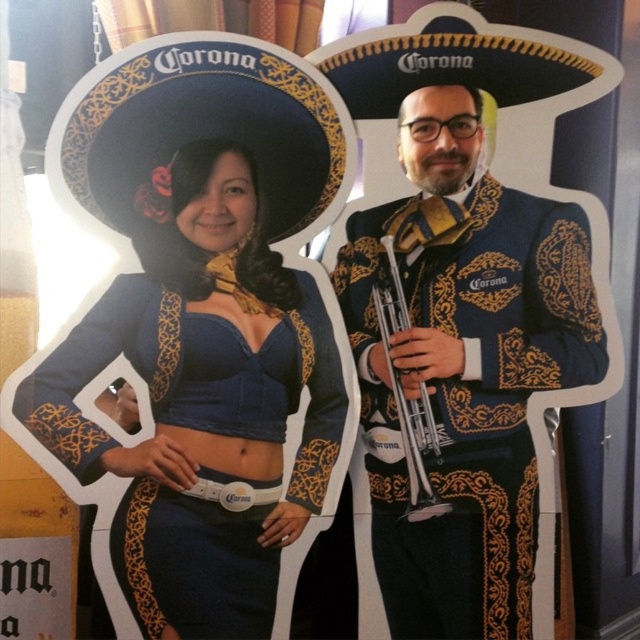
From the picture: You are a stagehand setting up for a performance. You have a matte gold trumpet at center and a matte black sombrero at upper left. The stage manager asks if the trumpet can be placed on top of the sombrero without falling over. Based on their sizes, what do you think?

The matte gold trumpet at center is larger in size than the matte black sombrero at upper left, so placing the trumpet on top of the sombrero might cause it to be unstable and possibly fall over due to the size difference.

You are at a costume party and want to place your silver metallic trumpet at center near the matte blue fabric dress at center. The venue requires that decorations be at least 10 inches apart for safety. Can you place the trumpet there?

The matte blue fabric dress at center is 10.28 inches away from the silver metallic trumpet at center, which meets the 10 inch requirement. Yes, you can place the trumpet there as it is slightly over the minimum distance.

You are a photographer setting up a shoot in front of these cutouts. You need to place a small microphone stand between the matte blue fabric dress at center and the silver metallic trumpet at center. Since the microphone stand has a base that is 30 cm wide, can you fit it between them without moving either object?

The matte blue fabric dress at center is positioned on the left side of silver metallic trumpet at center, so the distance between them must be at least 30 cm for the microphone stand to fit. However, the provided information does not specify the exact distance between them, so it is uncertain if the microphone stand will fit without additional measurements.